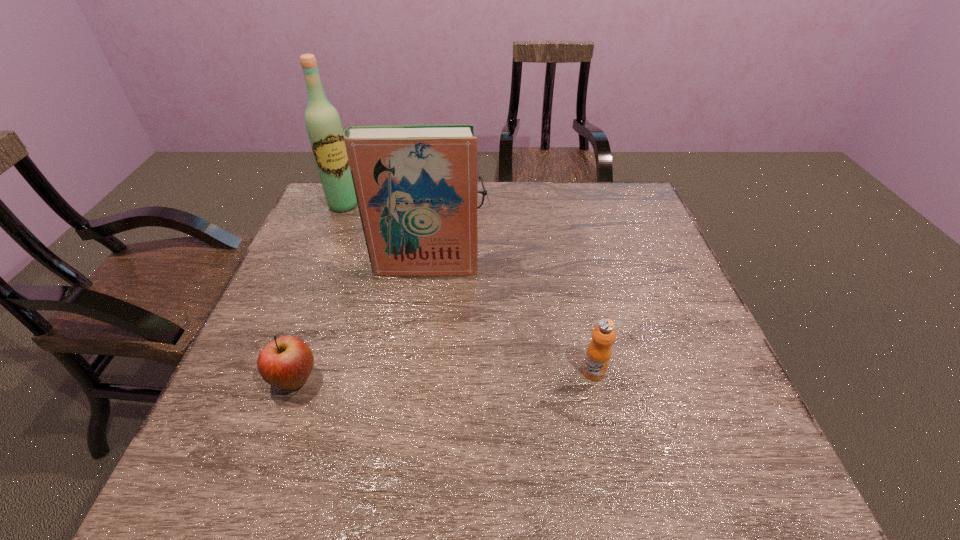
Where is `vacant space at the far right corner of the desktop`? The width and height of the screenshot is (960, 540). vacant space at the far right corner of the desktop is located at coordinates (614, 183).

Image resolution: width=960 pixels, height=540 pixels. I want to click on unoccupied area between the rightmost object and the spectacles, so click(x=524, y=286).

This screenshot has width=960, height=540. What are the coordinates of `free space between the fourth tallest object and the wine bottle` in the screenshot? It's located at (319, 293).

The width and height of the screenshot is (960, 540). I want to click on free space that is in between the second tallest object and the second shortest object, so click(x=360, y=323).

Where is `free space that is in between the wine bottle and the third shortest object`? free space that is in between the wine bottle and the third shortest object is located at coordinates coord(468,288).

Find the location of a particular element. The image size is (960, 540). free space between the third shortest object and the third farthest object is located at coordinates (509, 319).

Image resolution: width=960 pixels, height=540 pixels. In order to click on blank region between the second tallest object and the rightmost object in this screenshot , I will do `click(509, 319)`.

Locate an element on the screen. Image resolution: width=960 pixels, height=540 pixels. vacant point located between the third tallest object and the hardback book is located at coordinates (509, 319).

Locate an element on the screen. free point between the spectacles and the third shortest object is located at coordinates (524, 286).

Choose which object is the nearest neighbor to the third nearest object. Please provide its 2D coordinates. Your answer should be formatted as a tuple, i.e. [(x, y)], where the tuple contains the x and y coordinates of a point satisfying the conditions above.

[(484, 193)]